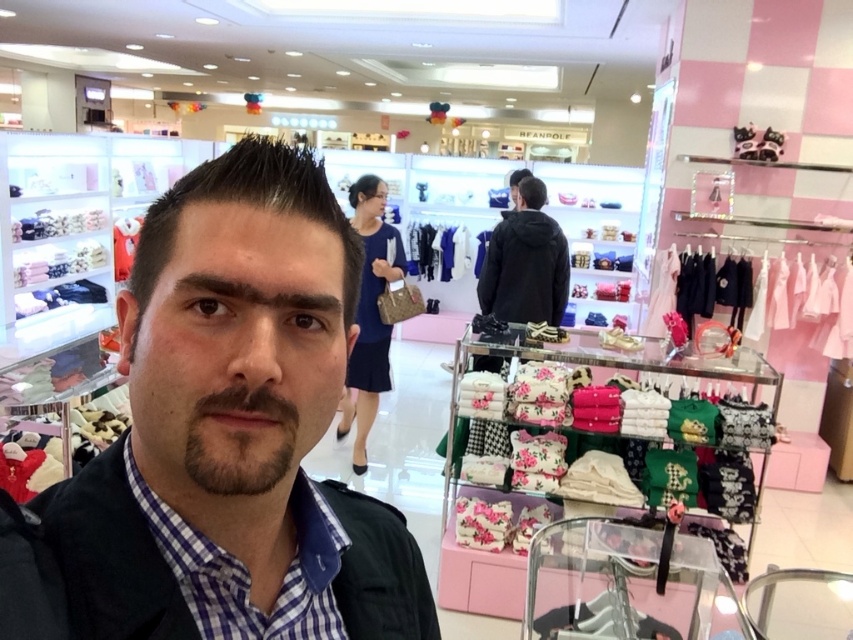
Who is more forward, (x=148, y=509) or (x=531, y=218)?

Point (x=148, y=509) is more forward.

Can you confirm if blue checkered shirt at center is taller than black fleece jacket at center?

No, blue checkered shirt at center is not taller than black fleece jacket at center.

Who is more forward, (300,596) or (531,243)?

Point (300,596) is more forward.

You are a GUI agent. You are given a task and a screenshot of the screen. Output one action in this format:
    pyautogui.click(x=<x>, y=<y>)
    Task: Click on the blue checkered shirt at center
    This screenshot has height=640, width=853.
    Given the screenshot: What is the action you would take?
    pyautogui.click(x=248, y=570)

Can you confirm if matte black jacket at center is positioned below blue checkered shirt at center?

No, matte black jacket at center is not below blue checkered shirt at center.

Who is positioned more to the left, matte black jacket at center or blue checkered shirt at center?

Positioned to the left is blue checkered shirt at center.

Which is in front, point (254, 248) or point (309, 499)?

Point (254, 248)

Where is `matte black jacket at center`? This screenshot has width=853, height=640. matte black jacket at center is located at coordinates pyautogui.click(x=234, y=429).

Who is positioned more to the left, matte black jacket at center or black fleece jacket at center?

Positioned to the left is matte black jacket at center.

Which is more to the right, matte black jacket at center or black fleece jacket at center?

Positioned to the right is black fleece jacket at center.

Is point (138, 422) farther from camera compared to point (524, 269)?

No.

The height and width of the screenshot is (640, 853). I want to click on matte black jacket at center, so click(x=234, y=429).